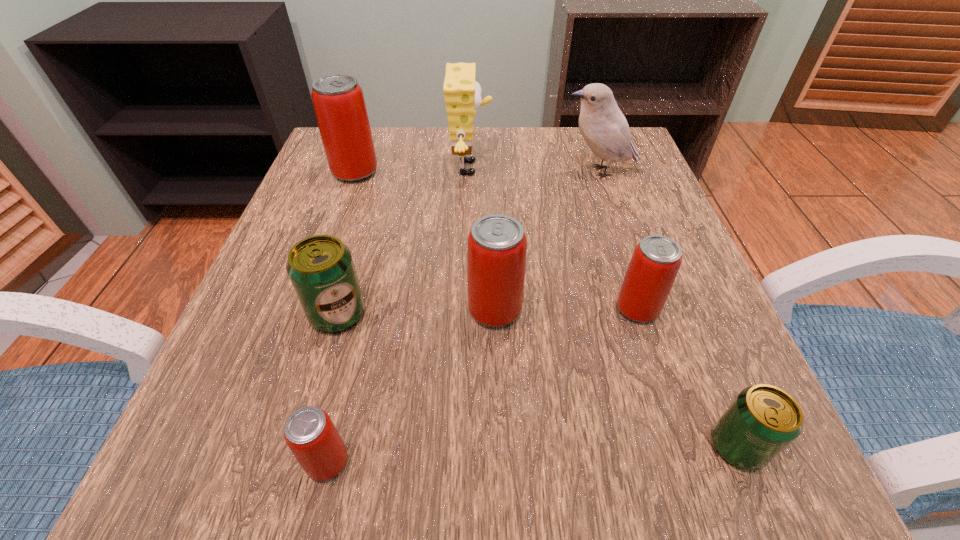
This screenshot has height=540, width=960. What are the coordinates of `the second closest beer can to the right green beer can` in the screenshot? It's located at pos(496,250).

Locate which pink beer can ranks in proximity to the second pink beer can from right to left. Please provide its 2D coordinates. Your answer should be formatted as a tuple, i.e. [(x, y)], where the tuple contains the x and y coordinates of a point satisfying the conditions above.

[(656, 260)]

Locate which pink beer can ranks second in proximity to the nearer green beer can. Please provide its 2D coordinates. Your answer should be formatted as a tuple, i.e. [(x, y)], where the tuple contains the x and y coordinates of a point satisfying the conditions above.

[(496, 250)]

Find the location of `vacant region that satisfies the following two spatial constraints: 1. on the front side of the bigger green beer can; 2. on the right side of the smaller green beer can`. vacant region that satisfies the following two spatial constraints: 1. on the front side of the bigger green beer can; 2. on the right side of the smaller green beer can is located at coordinates (300, 446).

Image resolution: width=960 pixels, height=540 pixels. I want to click on vacant region that satisfies the following two spatial constraints: 1. on the front side of the farthest beer can; 2. on the left side of the second smallest pink beer can, so click(x=306, y=309).

Find the location of a particular element. Image resolution: width=960 pixels, height=540 pixels. free location that satisfies the following two spatial constraints: 1. on the front-facing side of the sponge; 2. on the back side of the fourth tallest object is located at coordinates (467, 310).

Where is `free space that satisfies the following two spatial constraints: 1. on the front-facing side of the fifth beer can from left to right; 2. on the right side of the sponge`? The width and height of the screenshot is (960, 540). free space that satisfies the following two spatial constraints: 1. on the front-facing side of the fifth beer can from left to right; 2. on the right side of the sponge is located at coordinates (467, 309).